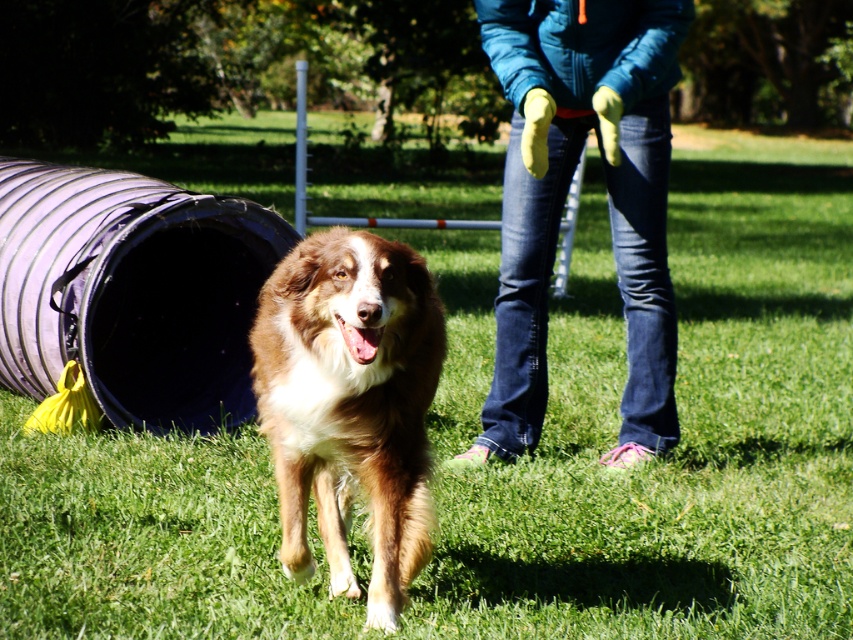
You are a photographer trying to capture the dog in motion. You notice the denim jeans at center and the rubberized purple tunnel at left in your viewfinder. Which object should you focus on to ensure the dog is centered in your shot?

To center the dog in your shot, focus on the denim jeans at center since it is positioned to the right of the rubberized purple tunnel at left, meaning the dog is likely moving towards the right side of the frame.

In the scene shown: You are a photographer trying to capture the brown fluffy dog at center without the denim jeans at center blocking the view. Can you adjust your position to do so?

The denim jeans at center is positioned over the brown fluffy dog at center, so adjusting your position to avoid the denim jeans at center blocking the view would allow you to capture the brown fluffy dog at center clearly.